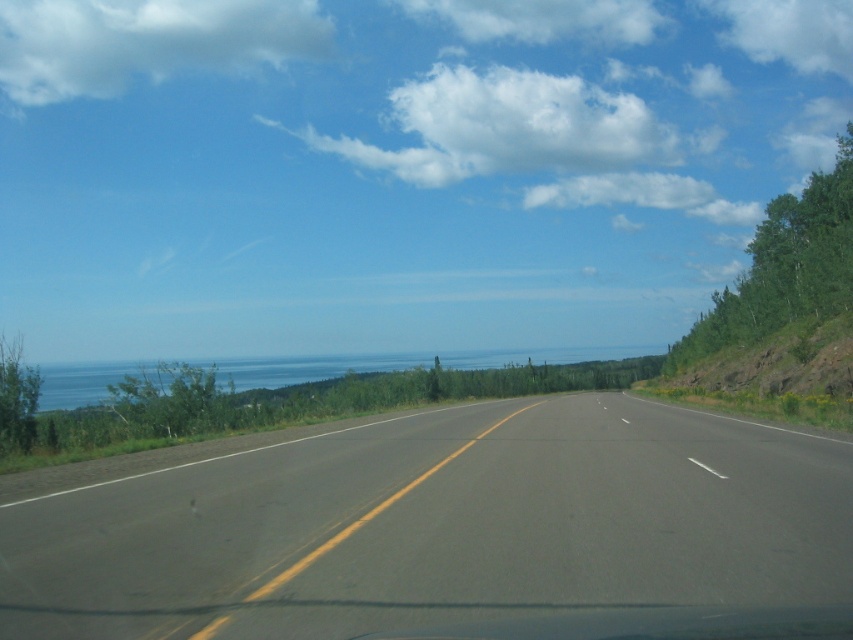
Does asphalt road at center have a lesser width compared to blue water at center?

Correct, asphalt road at center's width is less than blue water at center's.

Can you confirm if asphalt road at center is wider than blue water at center?

Incorrect, asphalt road at center's width does not surpass blue water at center's.

At what (x,y) coordinates should I click in order to perform the action: click on asphalt road at center. Please return your answer as a coordinate pair (x, y). The image size is (853, 640). Looking at the image, I should click on (454, 532).